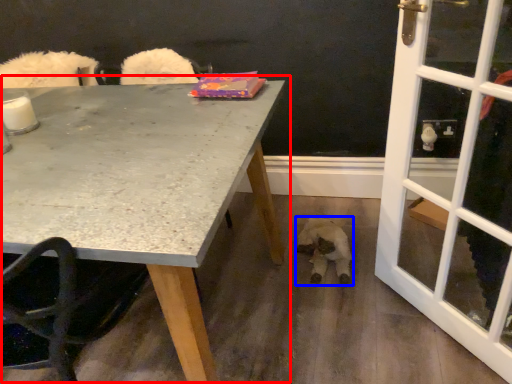
Question: Among these objects, which one is nearest to the camera, table (highlighted by a red box) or animal (highlighted by a blue box)?

Choices:
 (A) table
 (B) animal

Answer: (A)